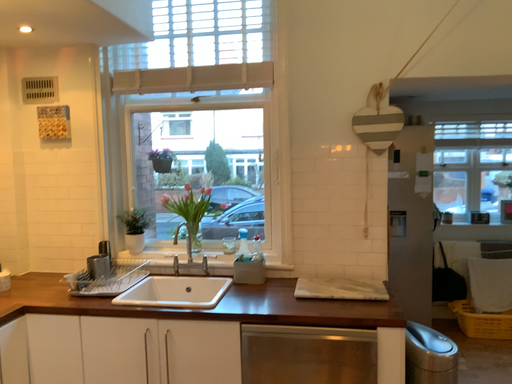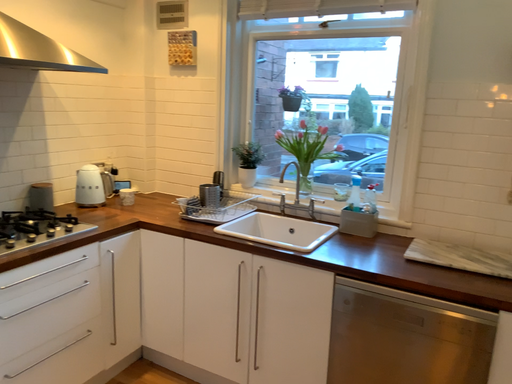
Question: How did the camera likely rotate when shooting the video?

Choices:
 (A) rotated upward
 (B) rotated downward

Answer: (B)